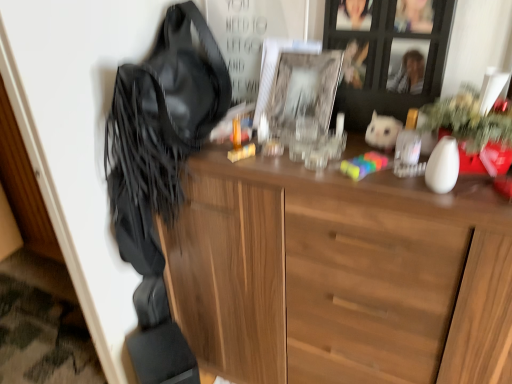
Question: Are white plush toy at upper right and leather fringe at left far apart?

Choices:
 (A) no
 (B) yes

Answer: (A)

Question: Is white plush toy at upper right turned away from leather fringe at left?

Choices:
 (A) yes
 (B) no

Answer: (B)

Question: Is leather fringe at left surrounded by white plush toy at upper right?

Choices:
 (A) no
 (B) yes

Answer: (A)

Question: Considering the relative sizes of white plush toy at upper right and leather fringe at left in the image provided, is white plush toy at upper right shorter than leather fringe at left?

Choices:
 (A) no
 (B) yes

Answer: (B)

Question: Is white plush toy at upper right taller than leather fringe at left?

Choices:
 (A) no
 (B) yes

Answer: (A)

Question: Does point (385, 130) appear closer or farther from the camera than point (323, 59)?

Choices:
 (A) farther
 (B) closer

Answer: (B)

Question: From the image's perspective, is white plush toy at upper right above or below clear glass picture frame at center?

Choices:
 (A) above
 (B) below

Answer: (B)

Question: Is white plush toy at upper right bigger or smaller than clear glass picture frame at center?

Choices:
 (A) small
 (B) big

Answer: (A)

Question: Do you think white plush toy at upper right is within clear glass picture frame at center, or outside of it?

Choices:
 (A) outside
 (B) inside

Answer: (A)

Question: In terms of height, does clear glass picture frame at center look taller or shorter compared to leather fringe at left?

Choices:
 (A) tall
 (B) short

Answer: (B)

Question: Considering the positions of point (267, 117) and point (160, 183), is point (267, 117) closer or farther from the camera than point (160, 183)?

Choices:
 (A) closer
 (B) farther

Answer: (B)

Question: Considering the relative positions of clear glass picture frame at center and leather fringe at left in the image provided, is clear glass picture frame at center to the left or to the right of leather fringe at left?

Choices:
 (A) right
 (B) left

Answer: (A)

Question: From a real-world perspective, is clear glass picture frame at center above or below leather fringe at left?

Choices:
 (A) below
 (B) above

Answer: (B)

Question: From a real-world perspective, is white plush toy at upper right physically located above or below wooden cabinet at upper center?

Choices:
 (A) above
 (B) below

Answer: (B)

Question: In the image, is white plush toy at upper right on the left side or the right side of wooden cabinet at upper center?

Choices:
 (A) right
 (B) left

Answer: (A)